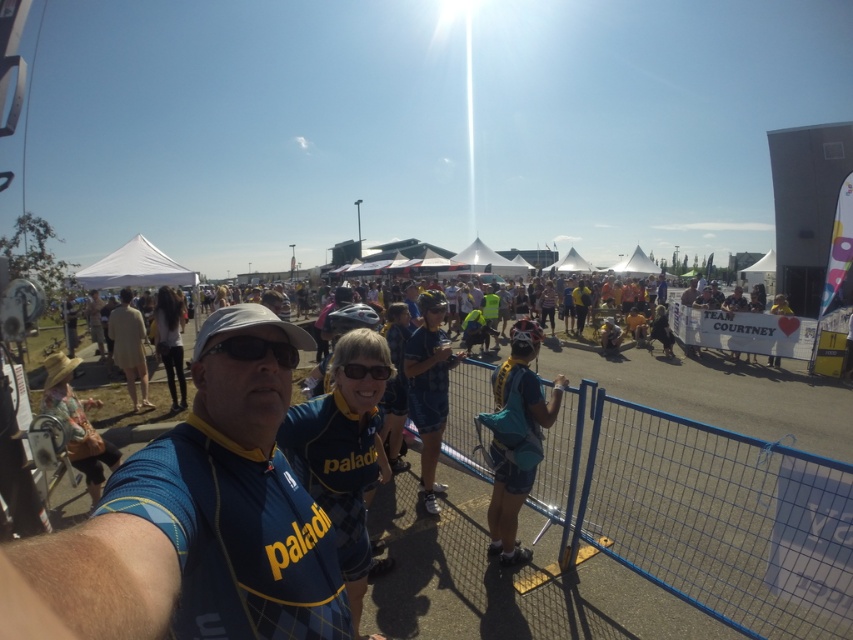
You are standing at the point labeled point (503, 378) and want to walk to the point labeled point (48, 385). Which direction should you move to get closer to your destination?

To move from point (503, 378) to point (48, 385), you should move downward since point (503, 378) is closer to the viewer than point (48, 385), indicating it is higher in the scene.

You are a photographer at the event and want to capture a photo of the blue wire mesh fence at center and the matte black goggles at center. Which object should you focus on first if you want to include both in the frame without moving the camera?

The matte black goggles at center should be focused on first because the blue wire mesh fence at center is positioned to the right of it, so adjusting focus to the goggles ensures both are in the frame.

You are a photographer at the event and want to capture both the blue jersey at center and the matte black goggles at center in a single frame. Based on their positions, can you fit both objects into your camera viewfinder without moving the camera?

The blue jersey at center might be wider than matte black goggles at center, so there is a possibility that the blue jersey at center could block the matte black goggles at center from being fully visible in the frame.